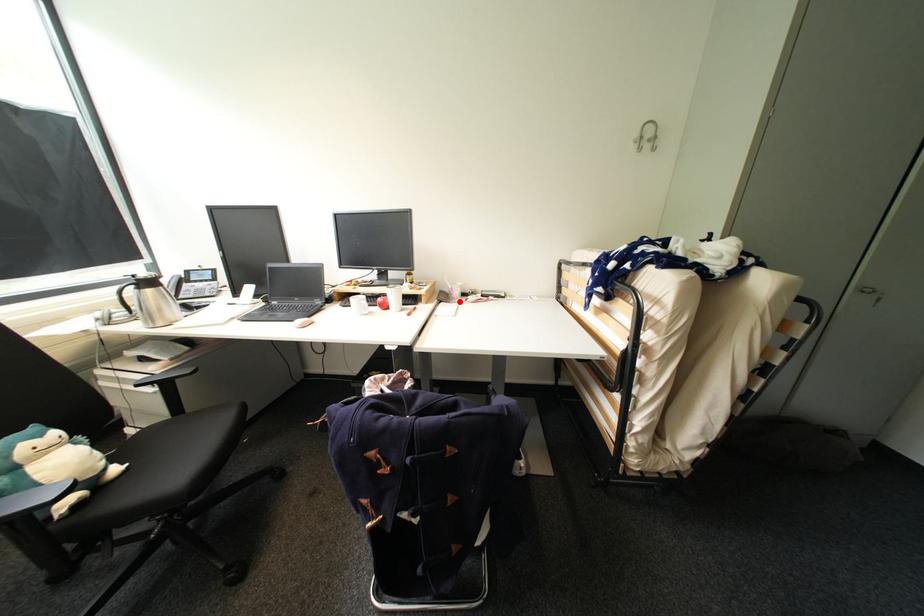
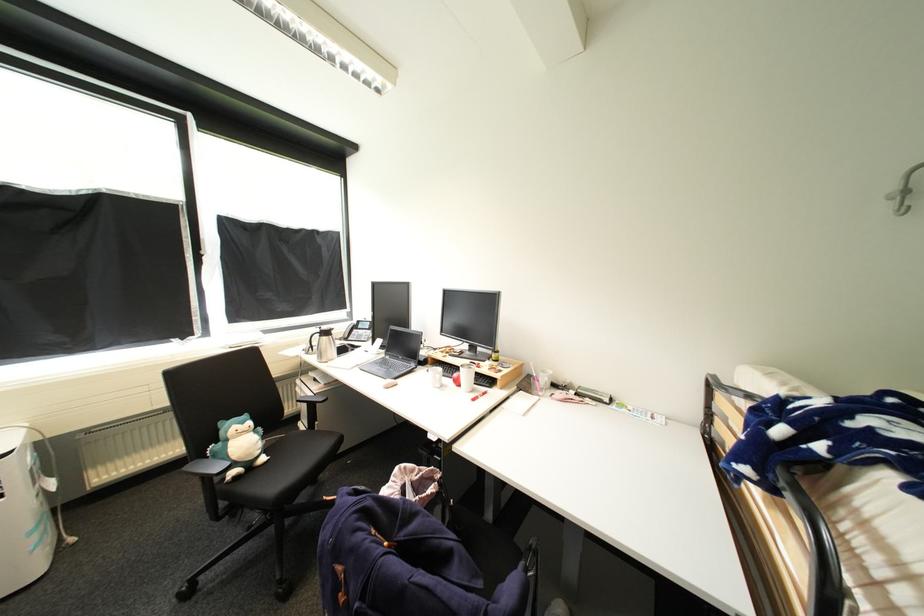
Find the pixel in the second image that matches the highlighted location in the first image.

(541, 392)